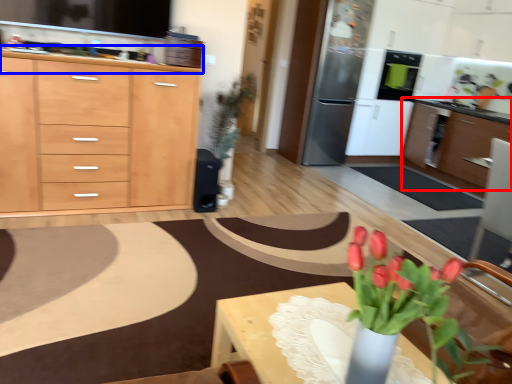
Question: Which object is further to the camera taking this photo, cabinetry (highlighted by a red box) or countertop (highlighted by a blue box)?

Choices:
 (A) cabinetry
 (B) countertop

Answer: (A)